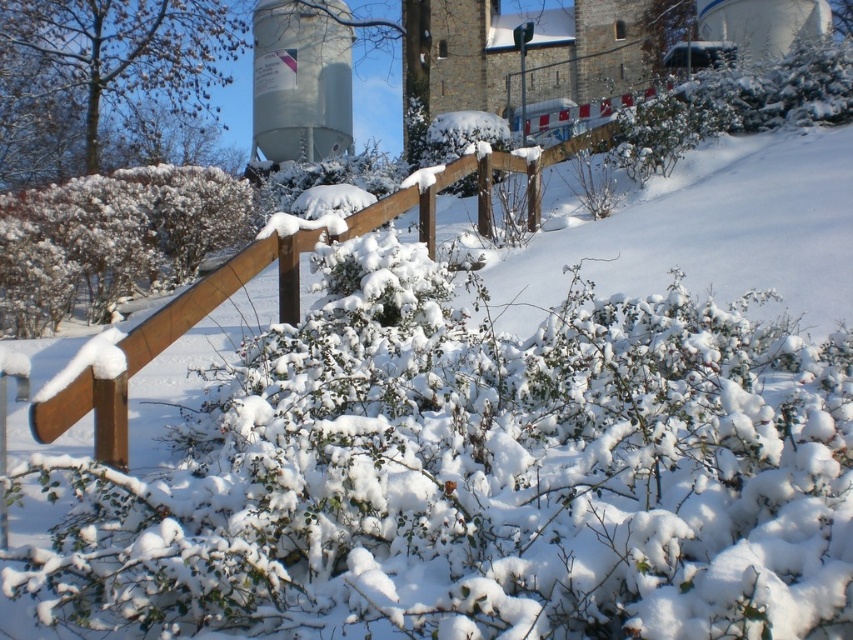
Question: Which object appears closest to the camera in this image?

Choices:
 (A) metallic gray water tower at upper center
 (B) white fluffy bush at left

Answer: (B)

Question: Which object is farther from the camera taking this photo?

Choices:
 (A) metallic gray water tower at upper center
 (B) white fluffy bush at left

Answer: (A)

Question: Where is white fluffy bush at left located in relation to metallic gray water tower at upper center in the image?

Choices:
 (A) above
 (B) below

Answer: (B)

Question: Among these points, which one is farthest from the camera?

Choices:
 (A) (28, 228)
 (B) (331, 6)

Answer: (B)

Question: Does white fluffy bush at left appear on the left side of metallic gray water tower at upper center?

Choices:
 (A) yes
 (B) no

Answer: (A)

Question: In this image, where is white fluffy bush at left located relative to metallic gray water tower at upper center?

Choices:
 (A) below
 (B) above

Answer: (A)